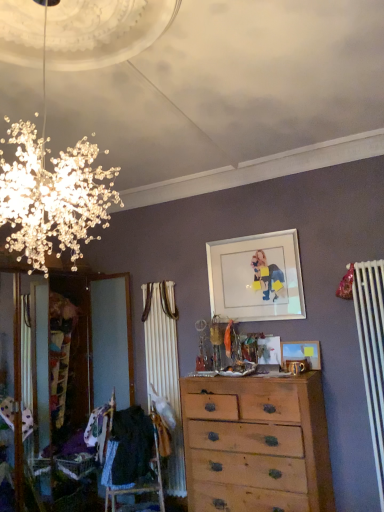
Question: Which direction should I rotate to look at light brown wooden chest of drawers at center?

Choices:
 (A) right
 (B) left

Answer: (A)

Question: Does black fabric at lower left have a lesser width compared to light brown wooden chest of drawers at center?

Choices:
 (A) no
 (B) yes

Answer: (B)

Question: Is black fabric at lower left turned away from light brown wooden chest of drawers at center?

Choices:
 (A) yes
 (B) no

Answer: (B)

Question: Would you consider black fabric at lower left to be distant from light brown wooden chest of drawers at center?

Choices:
 (A) yes
 (B) no

Answer: (B)

Question: Is black fabric at lower left with light brown wooden chest of drawers at center?

Choices:
 (A) yes
 (B) no

Answer: (B)

Question: From a real-world perspective, is black fabric at lower left located beneath light brown wooden chest of drawers at center?

Choices:
 (A) yes
 (B) no

Answer: (B)

Question: Does black fabric at lower left lie behind light brown wooden chest of drawers at center?

Choices:
 (A) no
 (B) yes

Answer: (B)

Question: Can you confirm if white glossy picture frame at upper center, the second picture frame in the bottom-to-top sequence, is thinner than wooden picture frame at center, the 1th picture frame ordered from the bottom?

Choices:
 (A) yes
 (B) no

Answer: (A)

Question: Is white glossy picture frame at upper center, the 1th picture frame from the top, to the left of wooden picture frame at center, the 1th picture frame ordered from the bottom, from the viewer's perspective?

Choices:
 (A) yes
 (B) no

Answer: (A)

Question: Is white glossy picture frame at upper center, the second picture frame in the bottom-to-top sequence, shorter than wooden picture frame at center, the 1th picture frame ordered from the bottom?

Choices:
 (A) no
 (B) yes

Answer: (A)

Question: Is white glossy picture frame at upper center, the second picture frame in the bottom-to-top sequence, not within wooden picture frame at center, the 1th picture frame ordered from the bottom?

Choices:
 (A) no
 (B) yes

Answer: (B)

Question: Is white glossy picture frame at upper center, the second picture frame in the bottom-to-top sequence, facing towards wooden picture frame at center, the 1th picture frame ordered from the bottom?

Choices:
 (A) yes
 (B) no

Answer: (B)

Question: From the image's perspective, is white glossy picture frame at upper center, the 1th picture frame from the top, below wooden picture frame at center, the 2th picture frame viewed from the top?

Choices:
 (A) yes
 (B) no

Answer: (B)

Question: Is the depth of wooden picture frame at center, the 2th picture frame viewed from the top, greater than that of white glossy picture frame at upper center, the 1th picture frame from the top?

Choices:
 (A) yes
 (B) no

Answer: (B)